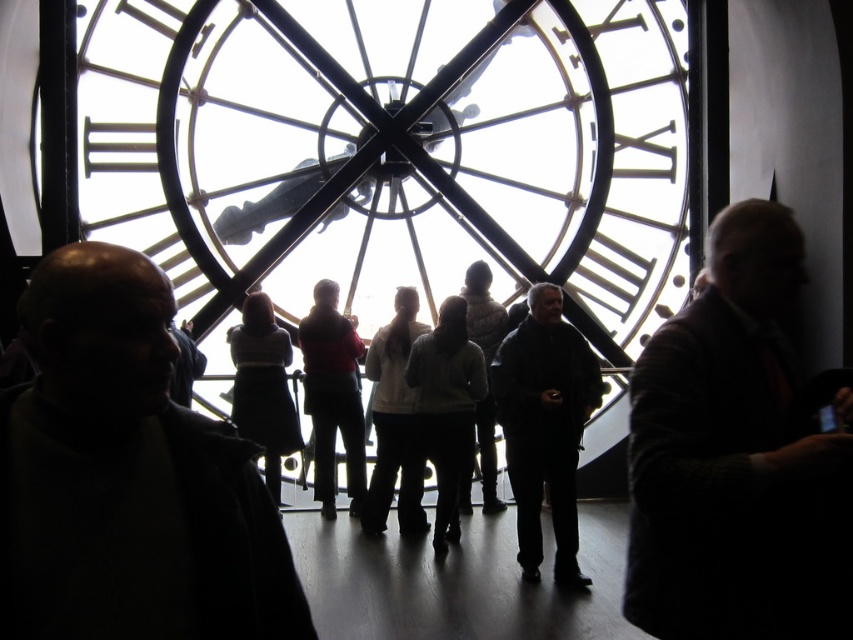
Question: Which object appears farthest from the camera in this image?

Choices:
 (A) dark matte jacket at left
 (B) light brown leather jacket at center

Answer: (B)

Question: Based on their relative distances, which object is nearer to the light gray sweater at center?

Choices:
 (A) transparent glass clock at center
 (B) white matte sweater at center

Answer: (B)

Question: Considering the relative positions of dark matte jacket at left and white sweater at center in the image provided, where is dark matte jacket at left located with respect to white sweater at center?

Choices:
 (A) left
 (B) right

Answer: (A)

Question: Which of the following is the closest to the observer?

Choices:
 (A) (541, 323)
 (B) (824, 481)
 (C) (486, 353)

Answer: (B)

Question: Does matte red sweater at center have a greater width compared to white textured sweater at center?

Choices:
 (A) yes
 (B) no

Answer: (A)

Question: Is transparent glass clock at center above dark matte coat at center?

Choices:
 (A) no
 (B) yes

Answer: (B)